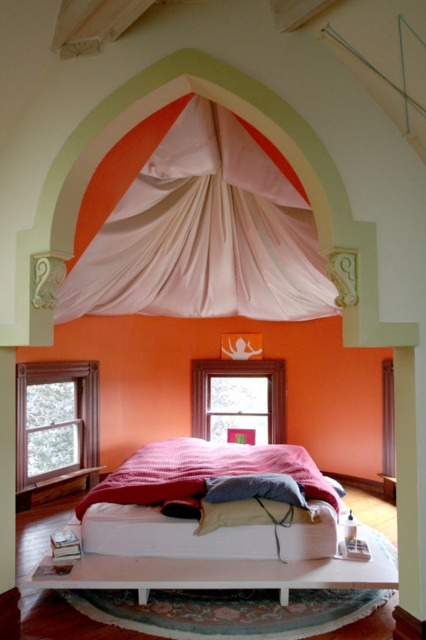
Which is above, matte wooden window at center or blue cotton pillow at center?

matte wooden window at center is above.

Does point (215, 435) come behind point (276, 474)?

Yes, point (215, 435) is behind point (276, 474).

The height and width of the screenshot is (640, 426). Find the location of `matte wooden window at center`. matte wooden window at center is located at coordinates (238, 401).

Does matte white bed at center have a smaller size compared to red textured blanket at center?

No.

You are a GUI agent. You are given a task and a screenshot of the screen. Output one action in this format:
    pyautogui.click(x=<x>, y=<y>)
    Task: Click on the matte white bed at center
    
    Given the screenshot: What is the action you would take?
    pyautogui.click(x=215, y=529)

Image resolution: width=426 pixels, height=640 pixels. What do you see at coordinates (215, 529) in the screenshot? I see `matte white bed at center` at bounding box center [215, 529].

In the scene shown: Is matte white bed at center positioned in front of matte wooden window at center?

Yes, it is in front of matte wooden window at center.

Does point (218, 472) lie behind point (226, 369)?

No, (218, 472) is closer to viewer.

Locate an element on the screen. This screenshot has height=640, width=426. matte white bed at center is located at coordinates (215, 529).